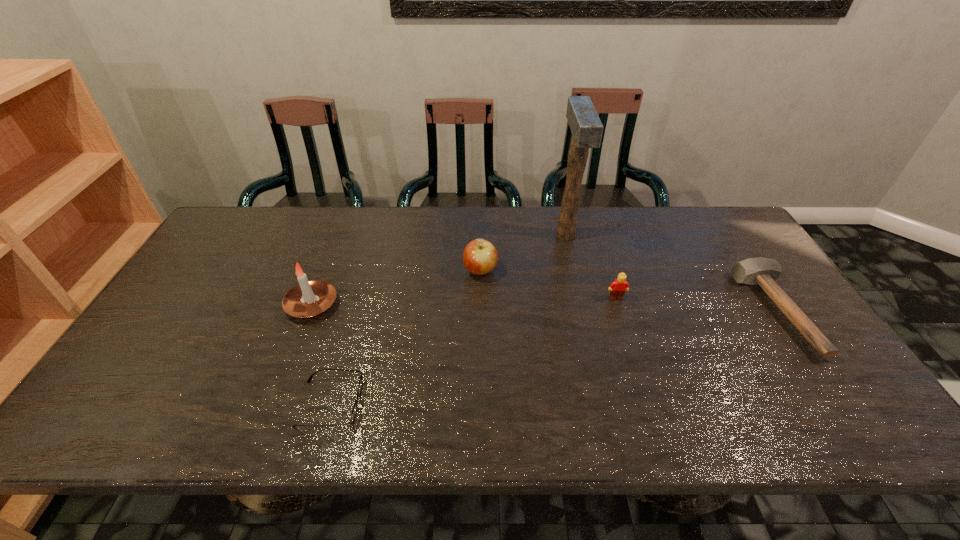
Locate an element on the screen. the taller mallet is located at coordinates (584, 122).

Find the location of `the farther mallet`. the farther mallet is located at coordinates (584, 122).

You are a GUI agent. You are given a task and a screenshot of the screen. Output one action in this format:
    pyautogui.click(x=<x>, y=<y>)
    Task: Click on the second tallest object
    The width and height of the screenshot is (960, 540).
    Given the screenshot: What is the action you would take?
    308,299

At what (x,y) coordinates should I click in order to perform the action: click on the third object from left to right. Please return your answer as a coordinate pair (x, y). The height and width of the screenshot is (540, 960). Looking at the image, I should click on (480, 257).

Locate an element on the screen. the fifth object from left to right is located at coordinates click(x=618, y=287).

Identify the location of the rightmost object. This screenshot has height=540, width=960. (763, 271).

You are a GUI agent. You are given a task and a screenshot of the screen. Output one action in this format:
    pyautogui.click(x=<x>, y=<y>)
    Task: Click on the second shortest object
    
    Given the screenshot: What is the action you would take?
    pyautogui.click(x=763, y=271)

Image resolution: width=960 pixels, height=540 pixels. I want to click on the nearest object, so click(x=354, y=411).

Locate an element on the screen. This screenshot has height=540, width=960. spectacles is located at coordinates (354, 411).

Locate an element on the screen. vacant space positioned on the front of the tallest object is located at coordinates (579, 295).